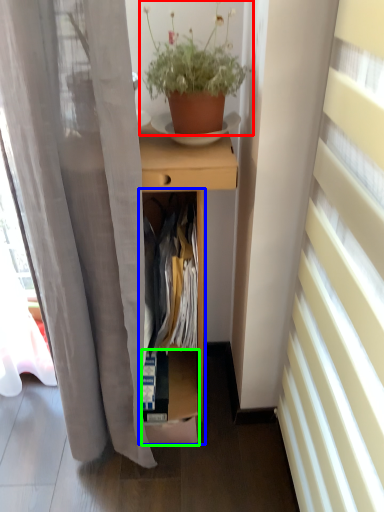
Question: Estimate the real-world distances between objects in this image. Which object is closer to houseplant (highlighted by a red box), cabinet (highlighted by a blue box) or shelf (highlighted by a green box)?

Choices:
 (A) cabinet
 (B) shelf

Answer: (A)